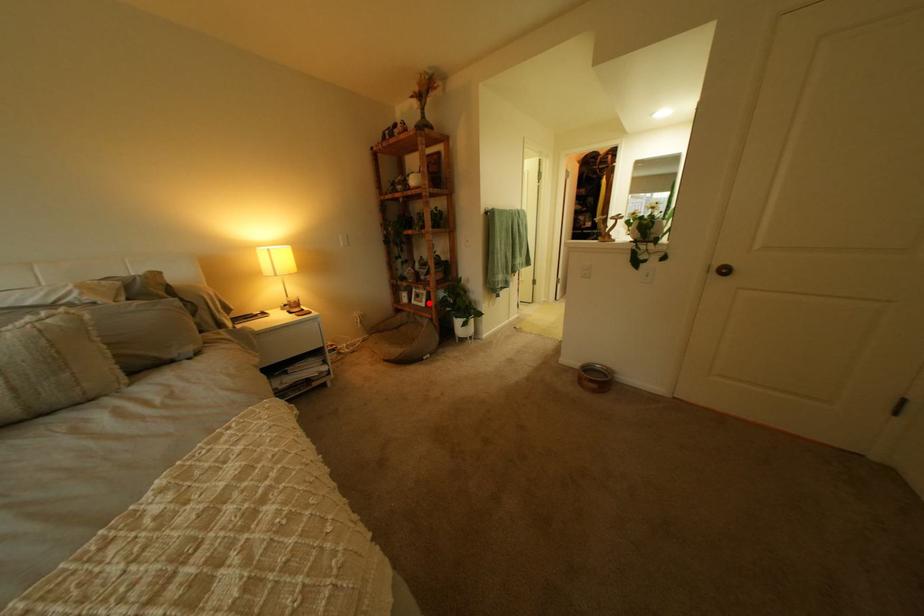
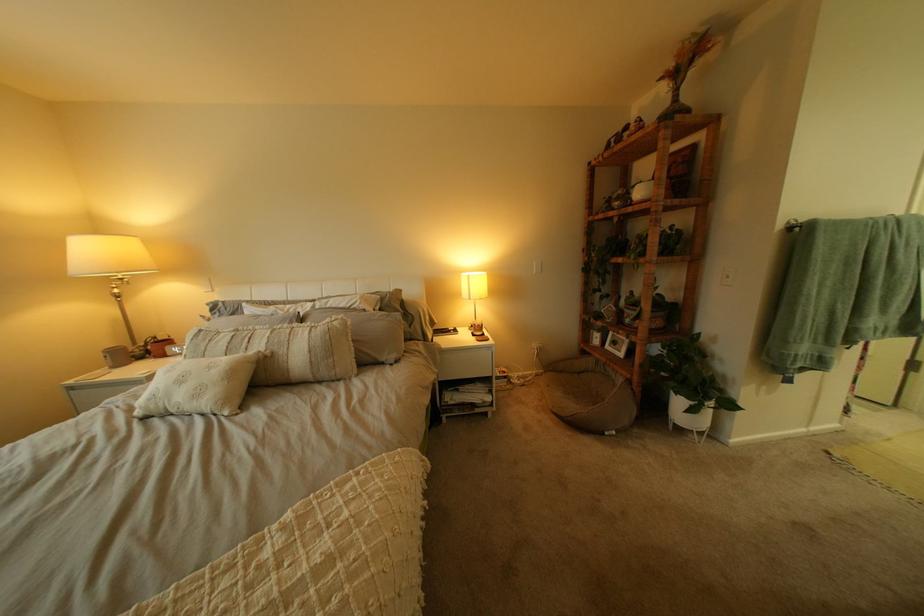
In the second image, find the point that corresponds to the highlighted location in the first image.

(623, 347)